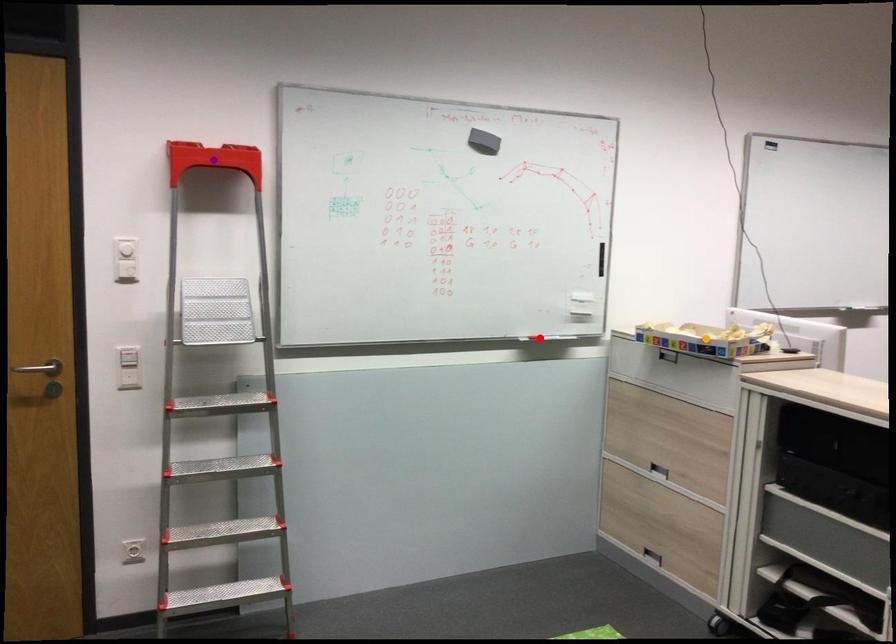
Order these from nearest to farthest:
A) purple point
B) red point
C) orange point

purple point
orange point
red point